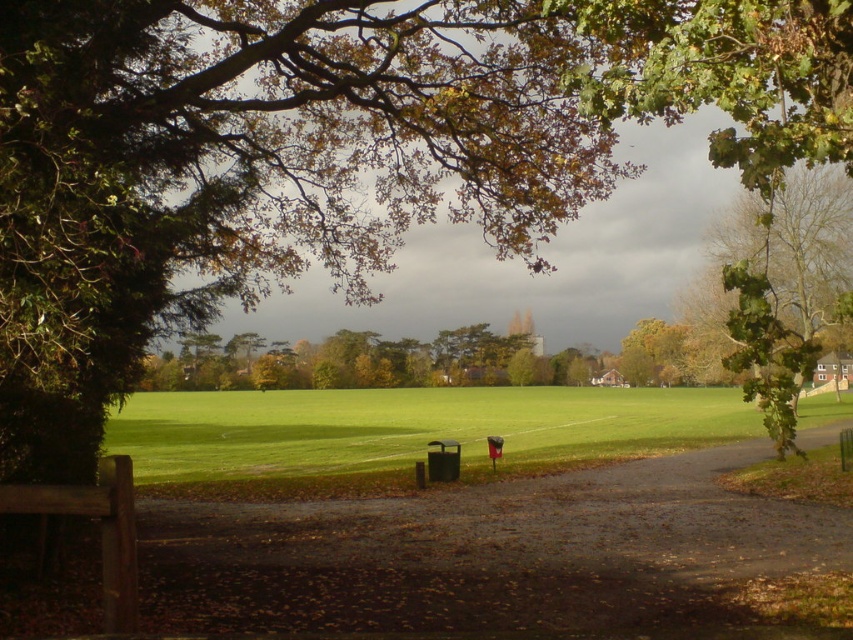
Question: Can you confirm if green leafy tree at upper center is smaller than green leafy tree at upper right?

Choices:
 (A) no
 (B) yes

Answer: (B)

Question: Considering the real-world distances, which object is closest to the green leafy tree at upper right?

Choices:
 (A) wooden bench at lower left
 (B) green grassy field at center
 (C) green leafy tree at upper center

Answer: (C)

Question: Which point is closer to the camera?

Choices:
 (A) (566, 410)
 (B) (3, 80)

Answer: (B)

Question: Can you confirm if green grassy field at center is positioned above wooden bench at lower left?

Choices:
 (A) no
 (B) yes

Answer: (A)

Question: Which object is positioned farthest from the green leafy tree at upper right?

Choices:
 (A) wooden bench at lower left
 (B) green grassy field at center
 (C) green leafy tree at upper center

Answer: (A)

Question: Observing the image, what is the correct spatial positioning of green grassy field at center in reference to wooden bench at lower left?

Choices:
 (A) above
 (B) below

Answer: (B)